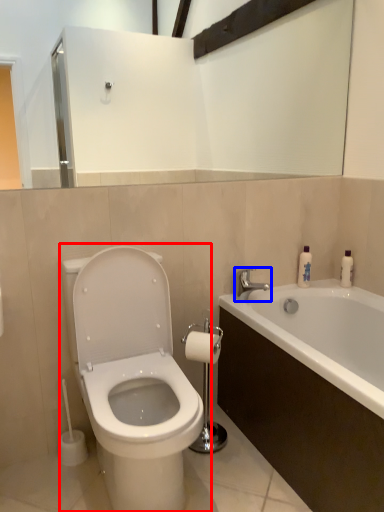
Question: Which object appears closest to the camera in this image, toilet (highlighted by a red box) or tap (highlighted by a blue box)?

Choices:
 (A) toilet
 (B) tap

Answer: (A)